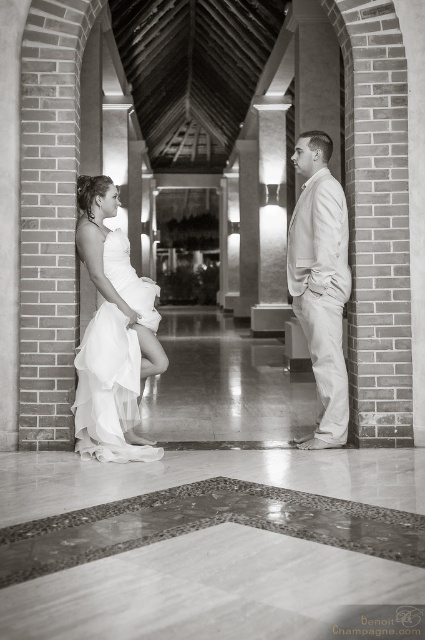
Can you confirm if light beige suit at center is positioned to the right of white tulle dress at center?

Indeed, light beige suit at center is positioned on the right side of white tulle dress at center.

Between point (342, 314) and point (133, 388), which one is positioned behind?

The point (342, 314) is behind.

Is point (342, 192) closer to camera compared to point (107, 410)?

That is False.

Locate an element on the screen. The width and height of the screenshot is (425, 640). light beige suit at center is located at coordinates (320, 284).

Measure the distance from white satin dress at left to light beige suit at center.

1.23 inches

Does white satin dress at left appear on the left side of light beige suit at center?

Indeed, white satin dress at left is positioned on the left side of light beige suit at center.

This screenshot has width=425, height=640. Identify the location of white satin dress at left. (320, 284).

Locate an element on the screen. white satin dress at left is located at coordinates (320, 284).

Between point (312, 358) and point (135, 417), which one is positioned in front?

Point (135, 417) is more forward.

Where is `white satin dress at left`? The image size is (425, 640). white satin dress at left is located at coordinates (320, 284).

Does point (152, 349) come in front of point (104, 248)?

Yes.

The width and height of the screenshot is (425, 640). Find the location of `white satin dress at left`. white satin dress at left is located at coordinates (320, 284).